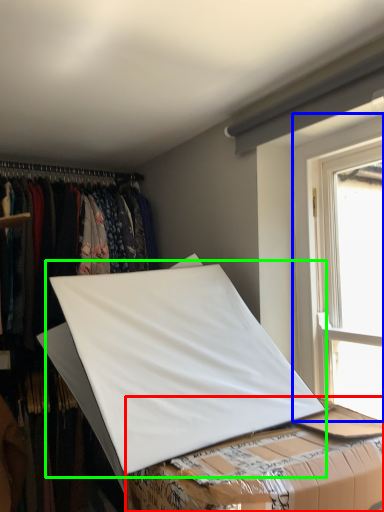
Question: Estimate the real-world distances between objects in this image. Which object is farther from table (highlighted by a red box), window (highlighted by a blue box) or linen (highlighted by a green box)?

Choices:
 (A) window
 (B) linen

Answer: (A)